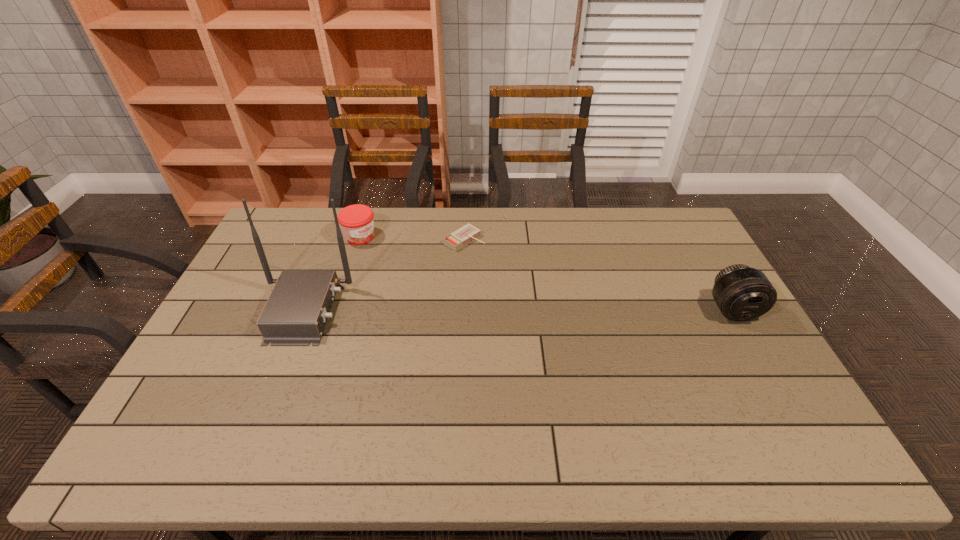
Identify the location of the tallest object. The image size is (960, 540). (295, 314).

You are a GUI agent. You are given a task and a screenshot of the screen. Output one action in this format:
    pyautogui.click(x=<x>, y=<y>)
    Task: Click on the rightmost object
    The image size is (960, 540).
    Given the screenshot: What is the action you would take?
    pyautogui.click(x=742, y=293)

Where is `the second tallest object`? The image size is (960, 540). the second tallest object is located at coordinates (742, 293).

Find the location of `the second shortest object`. the second shortest object is located at coordinates (357, 223).

Find the location of `matchbox`. matchbox is located at coordinates (468, 233).

I want to click on the second object from right to left, so pyautogui.click(x=468, y=233).

This screenshot has width=960, height=540. Identify the location of blank space located 0.100m on the back of the tallest object to connect cables. (380, 310).

The image size is (960, 540). I want to click on free space located 0.070m on the front-facing side of the rightmost object, so click(x=752, y=344).

You are a GUI agent. You are given a task and a screenshot of the screen. Output one action in this format:
    pyautogui.click(x=<x>, y=<y>)
    Task: Click on the free spot located 0.070m on the label side of the second shortest object
    The height and width of the screenshot is (540, 960).
    Given the screenshot: What is the action you would take?
    pyautogui.click(x=383, y=252)

This screenshot has height=540, width=960. In order to click on vacant space situated 0.140m on the label side of the second shortest object in this screenshot , I will do `click(396, 261)`.